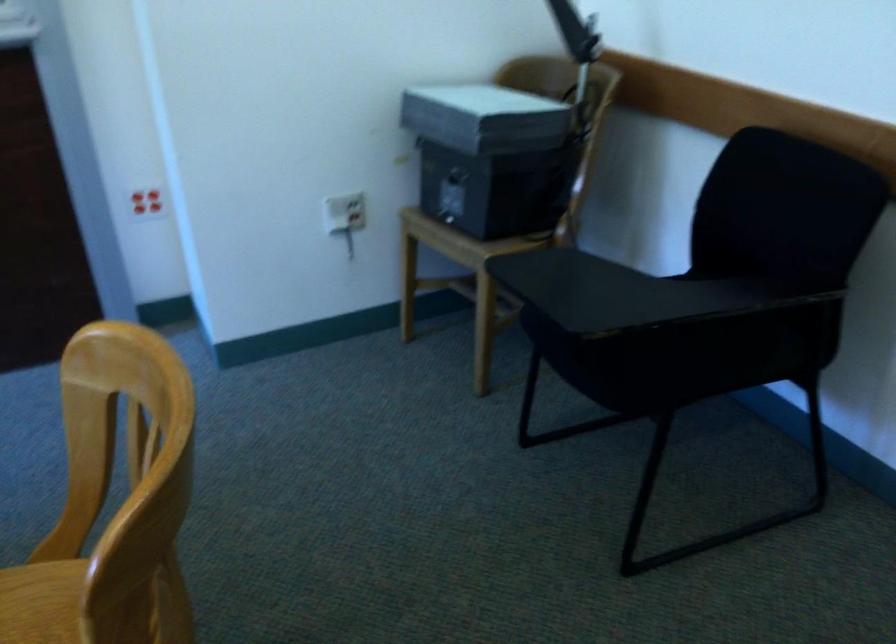
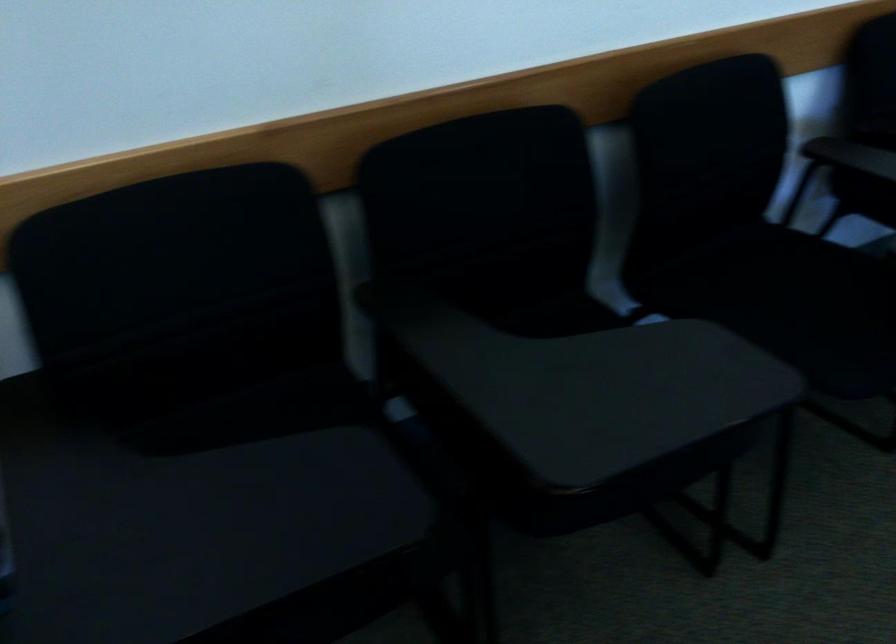
First-person continuous shooting, in which direction is the camera rotating?

The camera rotated toward right-down.